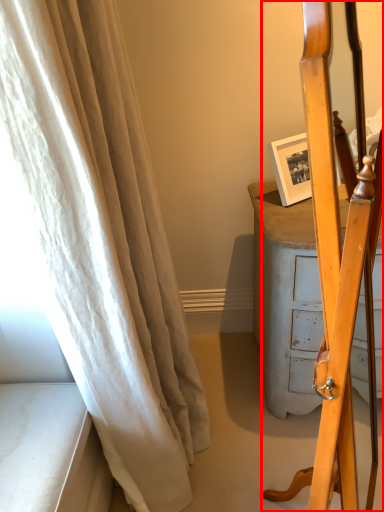
Question: In this image, where is furniture (annotated by the red box) located relative to curtain?

Choices:
 (A) right
 (B) left

Answer: (A)